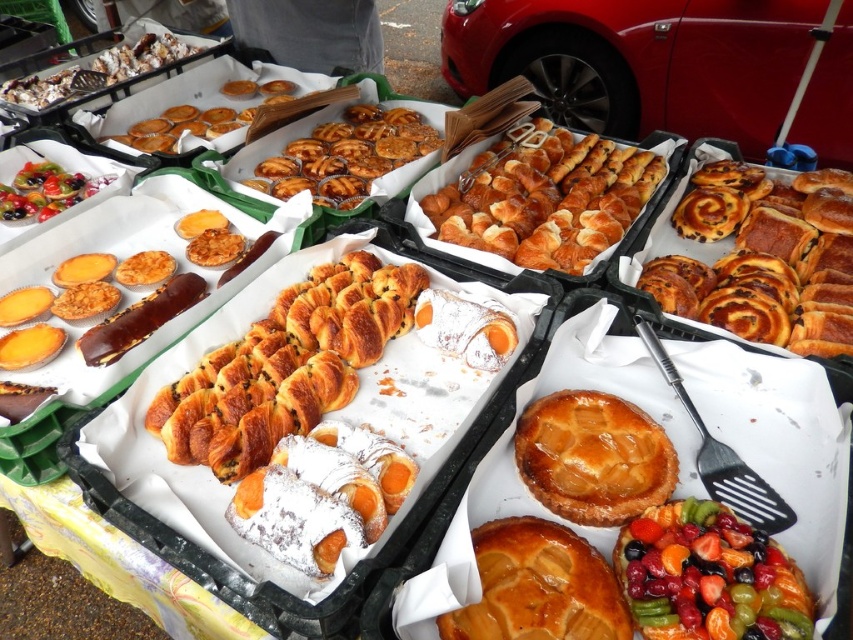
You are a customer at the market stall and want to choose between the golden brown dough at right and the golden flaky pie at center. Which one is wider?

The golden brown dough at right is wider than the golden flaky pie at center because its width surpasses the latter.

Looking at the market stall table with the yellow cloth, you see the golden brown dough at right and the golden glazed tart at center. Which pastry is positioned farther to the right?

The golden brown dough at right is positioned to the right of the golden glazed tart at center, so it is farther to the right.